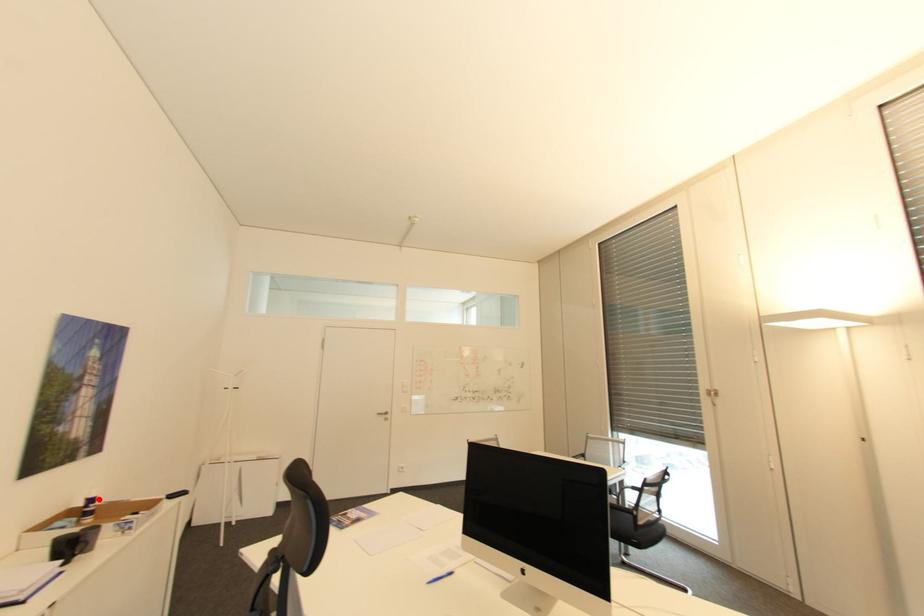
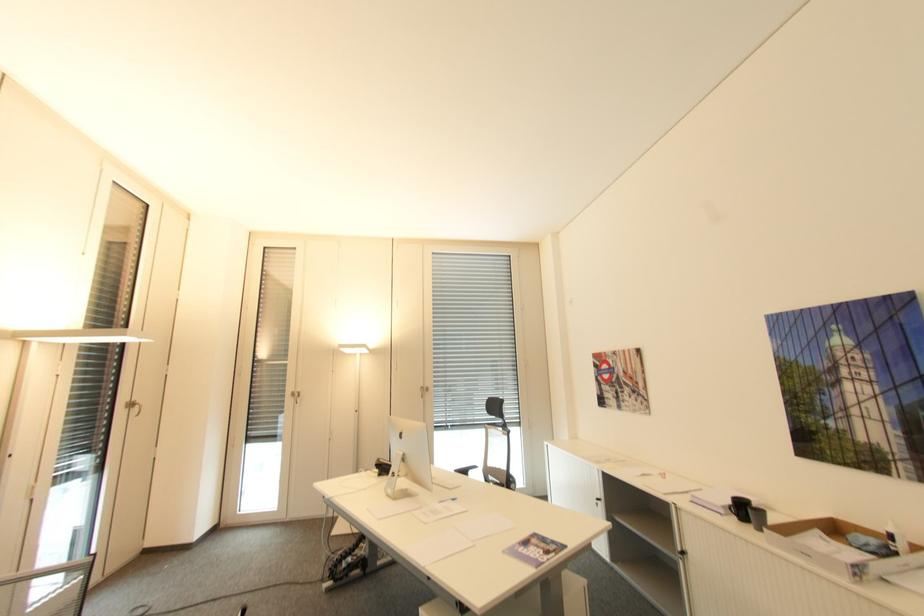
In the second image, find the point that corresponds to the highlighted location in the first image.

(895, 537)